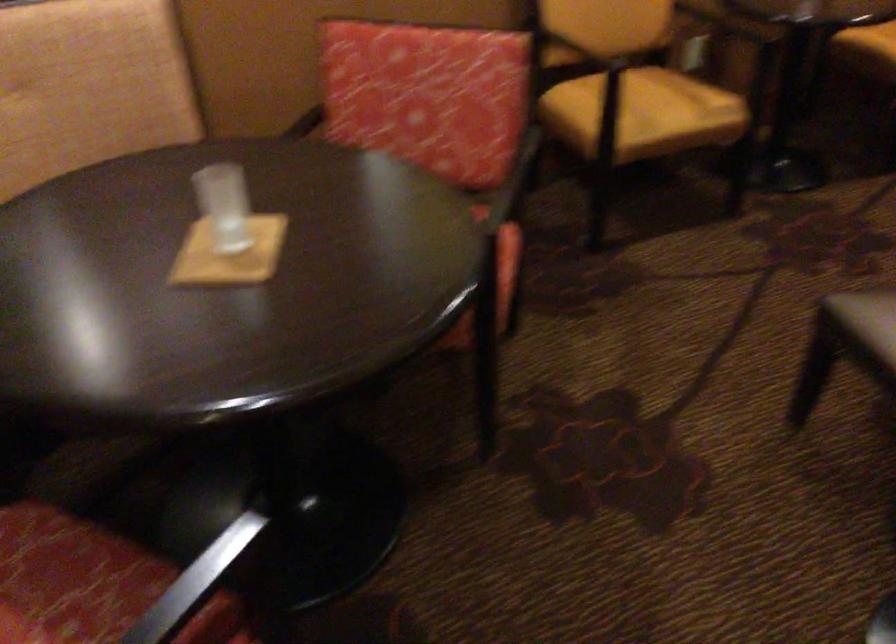
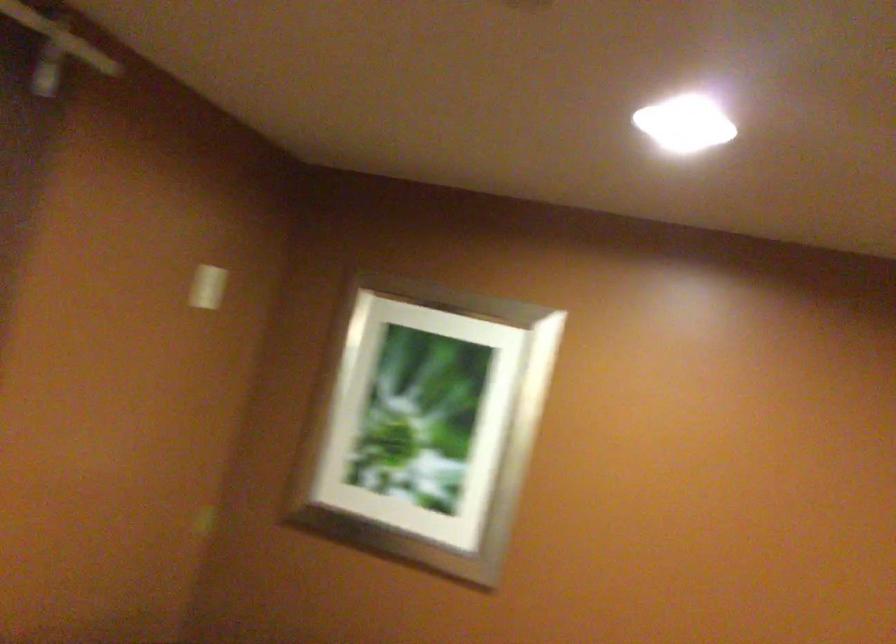
Based on the continuous images, in which direction is the camera rotating?

The rotation direction of the camera is left-up.